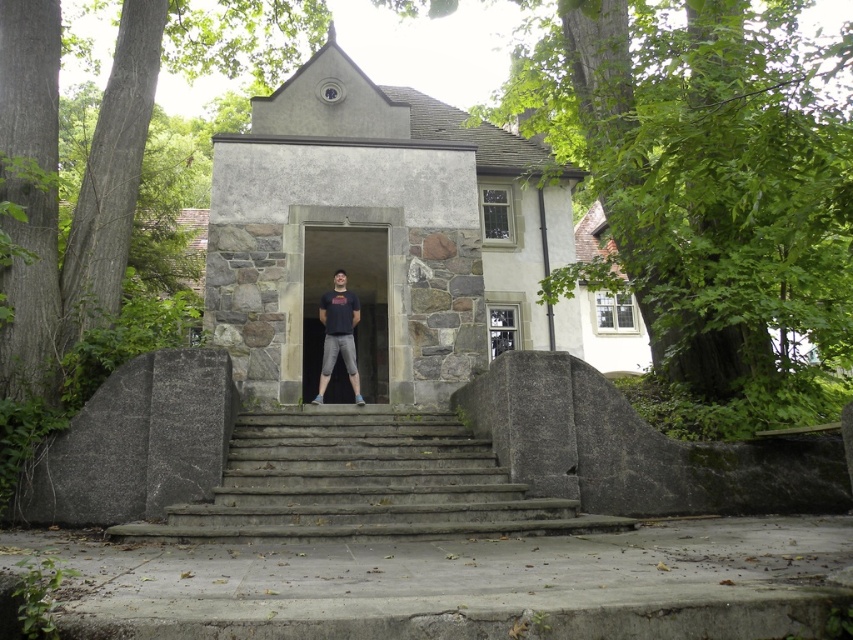
Question: Is gray concrete stairs at center further to camera compared to dark blue t-shirt at center?

Choices:
 (A) no
 (B) yes

Answer: (A)

Question: Which object is closer to the camera taking this photo?

Choices:
 (A) gray concrete stairs at center
 (B) stone gray chapel at center
 (C) dark blue t-shirt at center
 (D) stone door at center

Answer: (A)

Question: Does stone gray chapel at center appear over gray concrete stairs at center?

Choices:
 (A) yes
 (B) no

Answer: (A)

Question: Which point appears closest to the camera in this image?

Choices:
 (A) (367, 369)
 (B) (334, 300)
 (C) (590, 529)

Answer: (C)

Question: Does stone gray chapel at center appear over stone door at center?

Choices:
 (A) no
 (B) yes

Answer: (B)

Question: Estimate the real-world distances between objects in this image. Which object is closer to the stone door at center?

Choices:
 (A) dark blue t-shirt at center
 (B) stone gray chapel at center

Answer: (A)